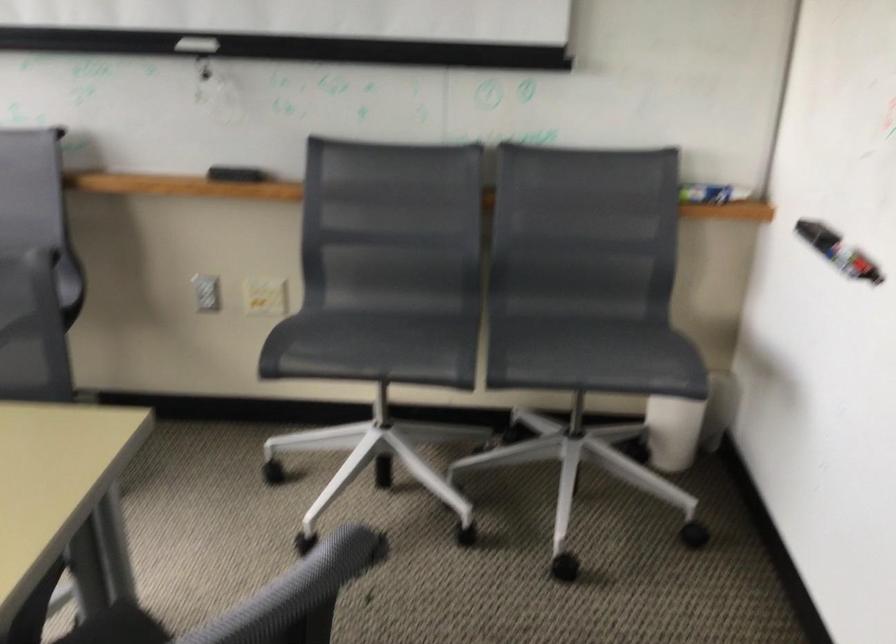
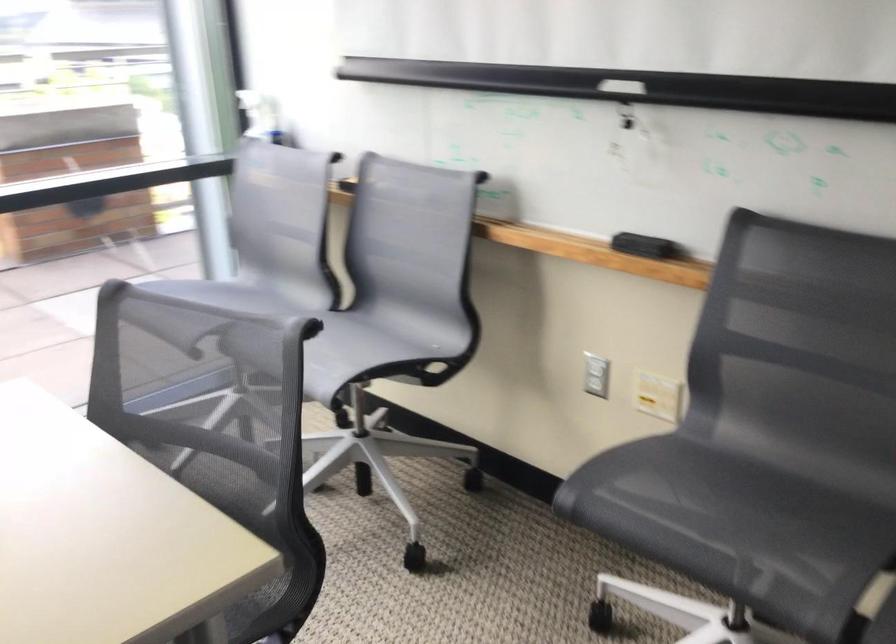
Locate, in the second image, the point that corresponds to (208,292) in the first image.

(596, 375)